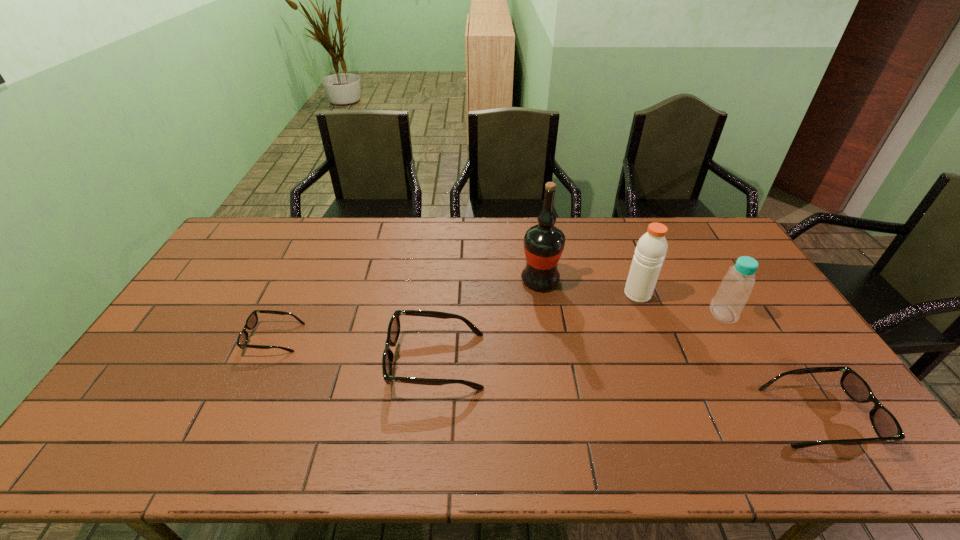
Identify the location of the closest spectacles relative to the fifth object from right to left. (252, 320).

I want to click on spectacles that stands as the closest to the shortest spectacles, so click(393, 332).

Locate an element on the screen. free point that satisfies the following two spatial constraints: 1. on the front side of the shaker; 2. on the left side of the bottle is located at coordinates [645, 314].

You are a GUI agent. You are given a task and a screenshot of the screen. Output one action in this format:
    pyautogui.click(x=<x>, y=<y>)
    Task: Click on the vacant space that satisfies the following two spatial constraints: 1. on the front side of the fourth object from left to right; 2. on the right side of the bottle
    This screenshot has height=540, width=960.
    Given the screenshot: What is the action you would take?
    pyautogui.click(x=645, y=314)